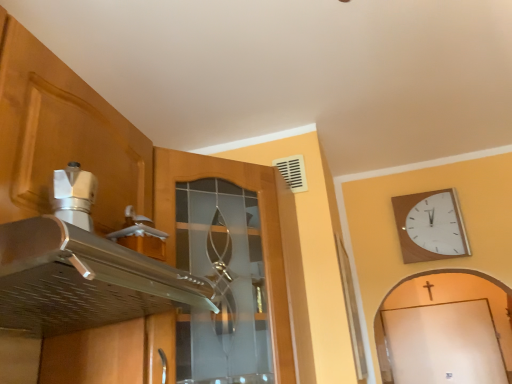
At what (x,y) coordinates should I click in order to perform the action: click on silver metallic exhaust hood at upper left. Please return your answer as a coordinate pair (x, y). Image resolution: width=512 pixels, height=384 pixels. Looking at the image, I should click on (83, 280).

This screenshot has height=384, width=512. Find the location of `matte wood cabinet at upper left`. matte wood cabinet at upper left is located at coordinates click(x=109, y=160).

Is silver metallic exhaust hood at upper left shorter than wooden wall clock at upper right?

Indeed, silver metallic exhaust hood at upper left has a lesser height compared to wooden wall clock at upper right.

Relative to wooden wall clock at upper right, is silver metallic exhaust hood at upper left in front or behind?

silver metallic exhaust hood at upper left is positioned closer to the viewer than wooden wall clock at upper right.

At what (x,y) coordinates should I click in order to perform the action: click on exhaust hood lying on the left of wooden wall clock at upper right. Please return your answer as a coordinate pair (x, y). The height and width of the screenshot is (384, 512). Looking at the image, I should click on (83, 280).

Is silver metallic exhaust hood at upper left in contact with wooden wall clock at upper right?

No, silver metallic exhaust hood at upper left is not beside wooden wall clock at upper right.

Is matte wood cabinet at upper left positioned with its back to wooden wall clock at upper right?

No.

Which of these two, matte wood cabinet at upper left or wooden wall clock at upper right, is bigger?

matte wood cabinet at upper left is bigger.

Can you confirm if matte wood cabinet at upper left is taller than wooden wall clock at upper right?

Indeed, matte wood cabinet at upper left has a greater height compared to wooden wall clock at upper right.

Is matte wood cabinet at upper left wider than wooden wall clock at upper right?

Yes.

Is there a large distance between wooden wall clock at upper right and matte wood cabinet at upper left?

wooden wall clock at upper right is positioned a significant distance from matte wood cabinet at upper left.

Considering the positions of point (413, 219) and point (141, 346), is point (413, 219) closer or farther from the camera than point (141, 346)?

Point (413, 219) is farther from the camera than point (141, 346).

Considering the relative positions of wooden wall clock at upper right and matte wood cabinet at upper left in the image provided, is wooden wall clock at upper right to the right of matte wood cabinet at upper left from the viewer's perspective?

Yes.

Where is `cabinetry lying behind the silver metallic exhaust hood at upper left`? The width and height of the screenshot is (512, 384). cabinetry lying behind the silver metallic exhaust hood at upper left is located at coordinates (109, 160).

From a real-world perspective, who is located higher, matte wood cabinet at upper left or silver metallic exhaust hood at upper left?

matte wood cabinet at upper left.

Considering the positions of objects wooden wall clock at upper right and silver metallic exhaust hood at upper left in the image provided, who is in front, wooden wall clock at upper right or silver metallic exhaust hood at upper left?

silver metallic exhaust hood at upper left is closer to the camera.

Between wooden wall clock at upper right and silver metallic exhaust hood at upper left, which one has smaller width?

With smaller width is wooden wall clock at upper right.

Does point (457, 245) lie behind point (112, 278)?

That is True.

Who is shorter, wooden wall clock at upper right or silver metallic exhaust hood at upper left?

silver metallic exhaust hood at upper left is shorter.

From the image's perspective, relative to matte wood cabinet at upper left, is silver metallic exhaust hood at upper left above or below?

Clearly, from the image's perspective, silver metallic exhaust hood at upper left is above matte wood cabinet at upper left.

Considering the sizes of objects silver metallic exhaust hood at upper left and matte wood cabinet at upper left in the image provided, who is smaller, silver metallic exhaust hood at upper left or matte wood cabinet at upper left?

silver metallic exhaust hood at upper left.

Can you tell me how much silver metallic exhaust hood at upper left and matte wood cabinet at upper left differ in facing direction?

They differ by 0.853 degrees in their facing directions.

Is silver metallic exhaust hood at upper left facing towards matte wood cabinet at upper left?

No, silver metallic exhaust hood at upper left is not oriented towards matte wood cabinet at upper left.

Locate an element on the screen. wall clock behind the silver metallic exhaust hood at upper left is located at coordinates (430, 226).

You are a GUI agent. You are given a task and a screenshot of the screen. Output one action in this format:
    pyautogui.click(x=<x>, y=<y>)
    Task: Click on the wall clock above the matte wood cabinet at upper left (from a real-world perspective)
    This screenshot has width=512, height=384.
    Given the screenshot: What is the action you would take?
    pyautogui.click(x=430, y=226)

Looking at this image, which object lies nearer to the anchor point matte wood cabinet at upper left, silver metallic exhaust hood at upper left or wooden wall clock at upper right?

The object closer to matte wood cabinet at upper left is silver metallic exhaust hood at upper left.

Based on their spatial positions, is wooden wall clock at upper right or matte wood cabinet at upper left closer to silver metallic exhaust hood at upper left?

matte wood cabinet at upper left is positioned closer to the anchor silver metallic exhaust hood at upper left.

Looking at the image, which one is located closer to silver metallic exhaust hood at upper left, matte wood cabinet at upper left or wooden wall clock at upper right?

matte wood cabinet at upper left is closer to silver metallic exhaust hood at upper left.

Considering their positions, is wooden wall clock at upper right positioned further to matte wood cabinet at upper left than silver metallic exhaust hood at upper left?

wooden wall clock at upper right is further to matte wood cabinet at upper left.

When comparing their distances from wooden wall clock at upper right, does matte wood cabinet at upper left or silver metallic exhaust hood at upper left seem further?

silver metallic exhaust hood at upper left.

Which object lies further to the anchor point wooden wall clock at upper right, silver metallic exhaust hood at upper left or matte wood cabinet at upper left?

The object further to wooden wall clock at upper right is silver metallic exhaust hood at upper left.

Find the location of a particular element. cabinetry positioned between silver metallic exhaust hood at upper left and wooden wall clock at upper right from near to far is located at coordinates (109, 160).